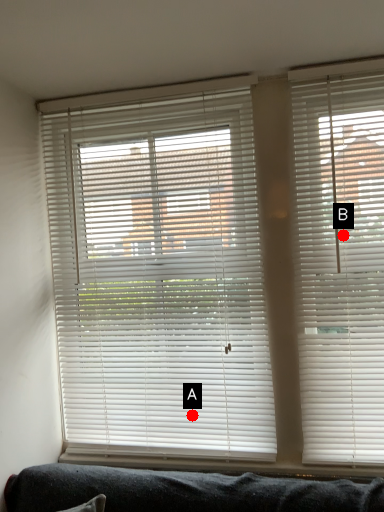
Question: Two points are circled on the image, labeled by A and B beside each circle. Among these points, which one is farthest from the camera?

Choices:
 (A) A is further
 (B) B is further

Answer: (A)